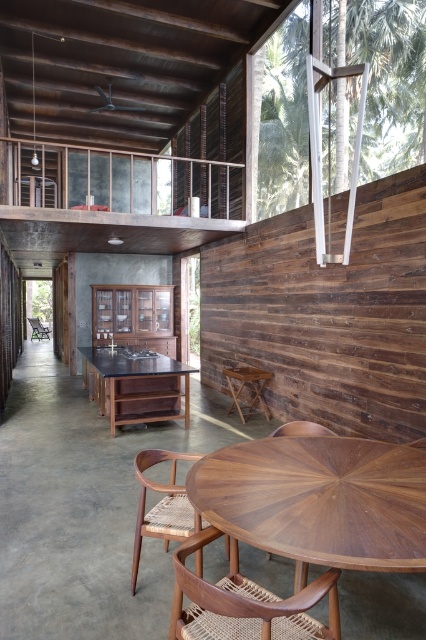
Can you confirm if wooden stool at center is bigger than green woven wood chair at left?

No.

Does point (256, 410) lie in front of point (32, 321)?

Yes, point (256, 410) is in front of point (32, 321).

Where is `wooden stool at center`? Image resolution: width=426 pixels, height=640 pixels. wooden stool at center is located at coordinates coord(242,387).

This screenshot has height=640, width=426. What do you see at coordinates (163, 506) in the screenshot?
I see `rattan woven chair at lower center` at bounding box center [163, 506].

Does rattan woven chair at lower center have a lesser height compared to wooden stool at center?

No.

Is point (135, 545) closer to viewer compared to point (256, 387)?

That is True.

This screenshot has width=426, height=640. Identify the location of rattan woven chair at lower center. (163, 506).

Is black wood table at center thinner than green woven wood chair at left?

No.

Looking at this image, is black wood table at center shorter than green woven wood chair at left?

Incorrect, black wood table at center's height does not fall short of green woven wood chair at left's.

Locate an element on the screen. black wood table at center is located at coordinates (135, 385).